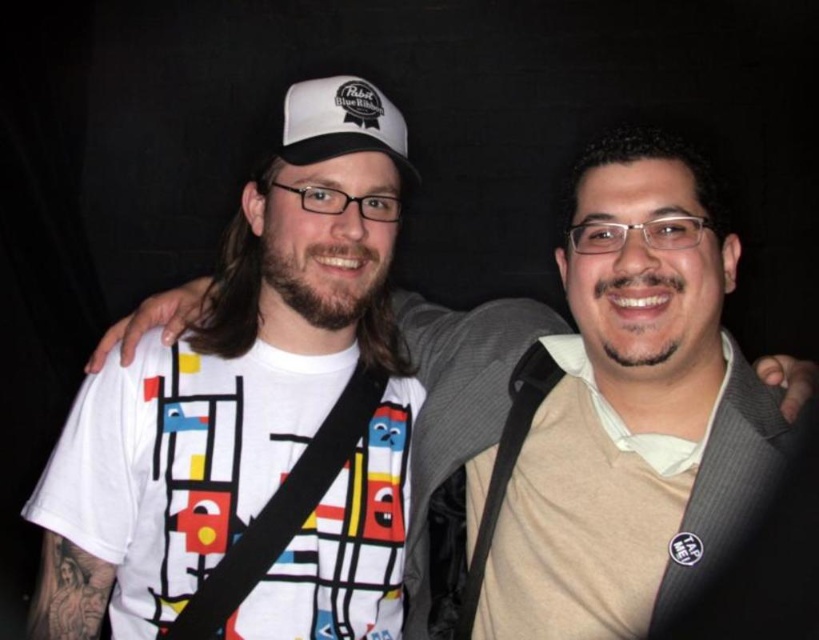
Does point (270, 554) come farther from viewer compared to point (320, 150)?

No, it is not.

Is black fabric strap at center closer to the viewer compared to white fabric cap at center?

Yes.

Does point (304, 508) come farther from viewer compared to point (396, 116)?

That is False.

Where is `black fabric strap at center`? black fabric strap at center is located at coordinates (283, 509).

Describe the element at coordinates (596, 413) in the screenshot. I see `white matte t-shirt at center` at that location.

Locate an element on the screen. white matte t-shirt at center is located at coordinates (596, 413).

How much distance is there between white matte t-shirt at center and black fabric strap at center?

The distance of white matte t-shirt at center from black fabric strap at center is 13.75 inches.

Between white matte t-shirt at center and black fabric strap at center, which one appears on the left side from the viewer's perspective?

From the viewer's perspective, black fabric strap at center appears more on the left side.

Who is more forward, (x=483, y=499) or (x=351, y=410)?

Point (x=483, y=499) is in front.

The height and width of the screenshot is (640, 819). I want to click on white matte t-shirt at center, so click(x=596, y=413).